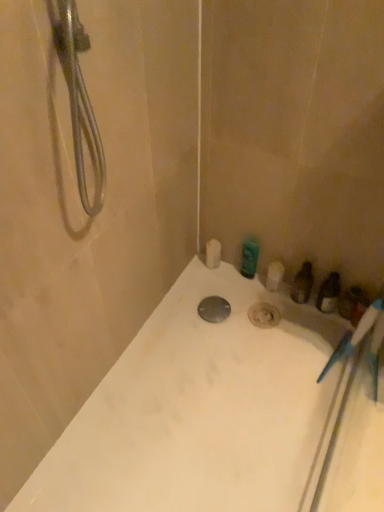
Image resolution: width=384 pixels, height=512 pixels. I want to click on vacant space that is to the left of green glossy bottle at upper right, the second toiletry viewed from the right, so click(208, 285).